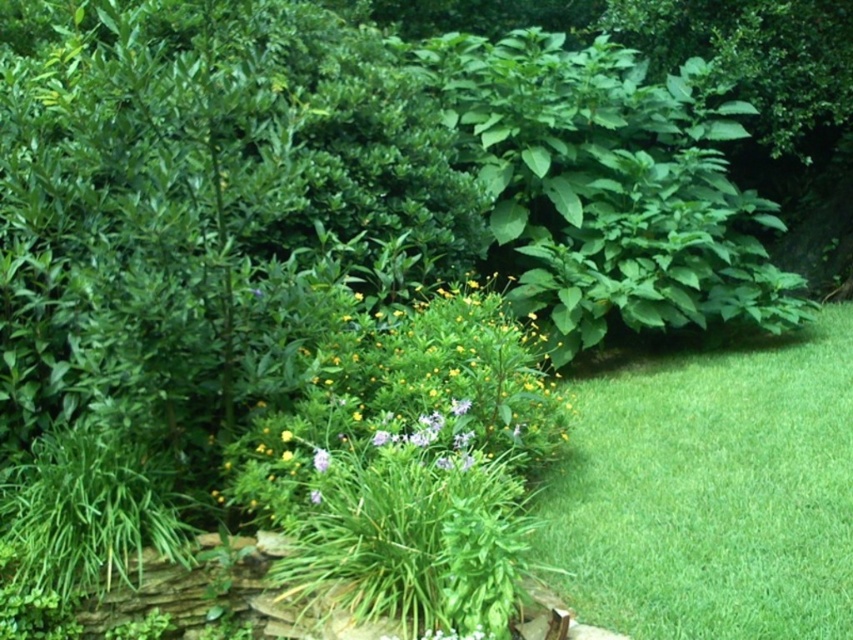
You are standing in the garden and want to walk from the green leafy plant at center to the green smooth grass at lower right. Which direction should you move?

You should move to the right because the green smooth grass at lower right is positioned on the right side of the green leafy plant at center.

You are a gardener planning to plant a new flower bed. You have a yellow matte flower at center that needs to be placed in an area wider than its current position. Looking at the garden scene, is there a suitable spot near the green smooth grass at lower right where it can be relocated?

The green smooth grass at lower right might be wider than the yellow matte flower at center, so it could provide a suitable wider area for relocation.